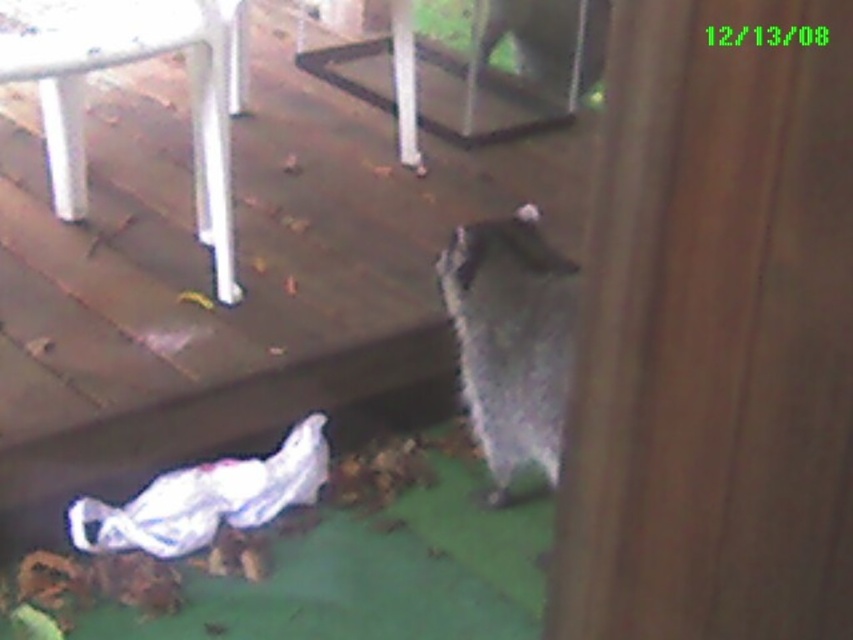
Does white plastic chair at upper left have a larger size compared to fuzzy gray cat at lower right?

Correct, white plastic chair at upper left is larger in size than fuzzy gray cat at lower right.

Does point (132, 22) lie behind point (461, 332)?

No, it is not.

Who is more distant from viewer, (68, 161) or (479, 244)?

The point (68, 161) is behind.

Where is `white plastic chair at upper left`? Image resolution: width=853 pixels, height=640 pixels. white plastic chair at upper left is located at coordinates (120, 64).

Can you confirm if brown wood screen door at right is positioned to the right of fuzzy gray cat at lower right?

Indeed, brown wood screen door at right is positioned on the right side of fuzzy gray cat at lower right.

Is brown wood screen door at right taller than fuzzy gray cat at lower right?

No, brown wood screen door at right is not taller than fuzzy gray cat at lower right.

Identify the location of brown wood screen door at right. (714, 336).

Is wooden deck at lower left to the right of fuzzy gray cat at lower right from the viewer's perspective?

In fact, wooden deck at lower left is to the left of fuzzy gray cat at lower right.

Is point (109, 336) behind point (461, 300)?

Yes, point (109, 336) is farther from viewer.

In order to click on wooden deck at lower left in this screenshot , I will do point(224,209).